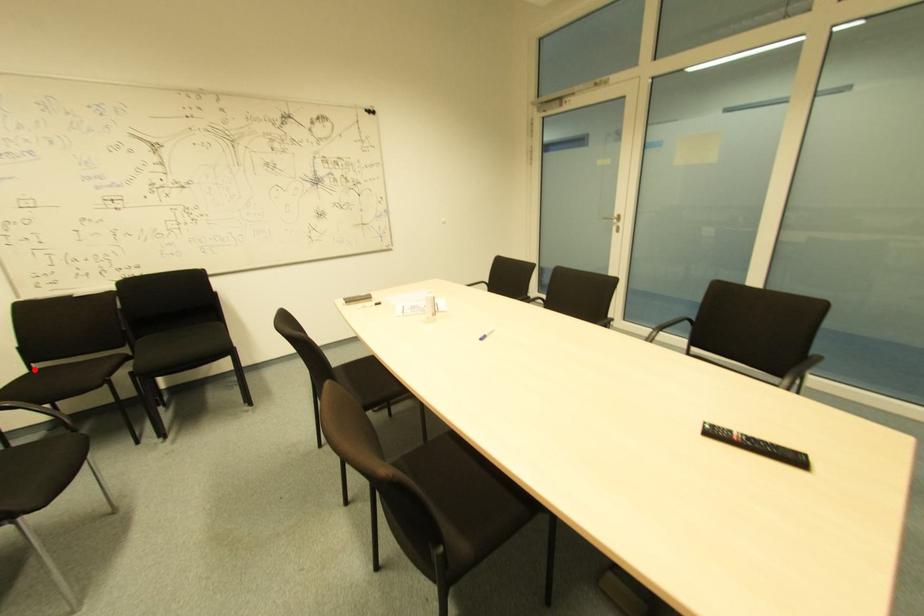
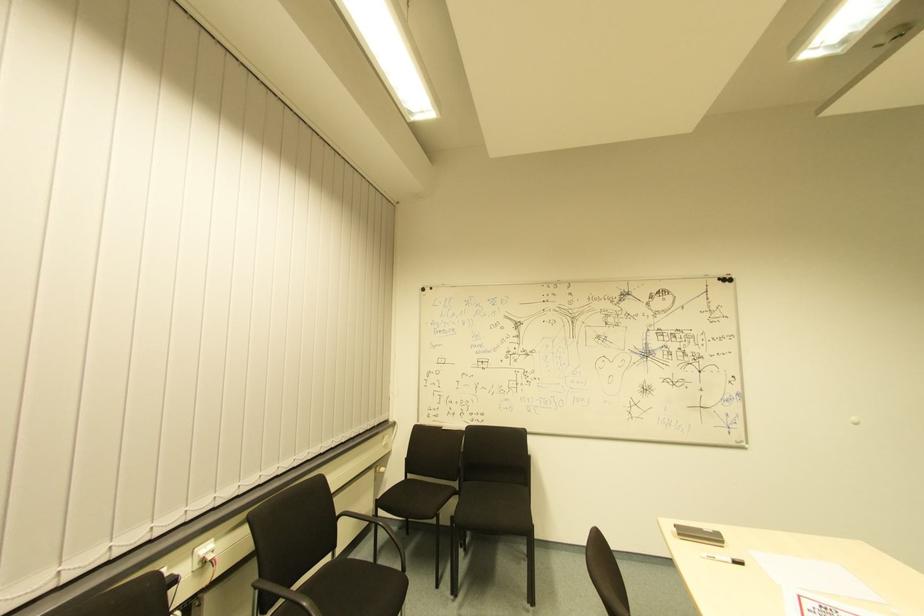
The point at the highlighted location is marked in the first image. Where is the corresponding point in the second image?

(408, 479)